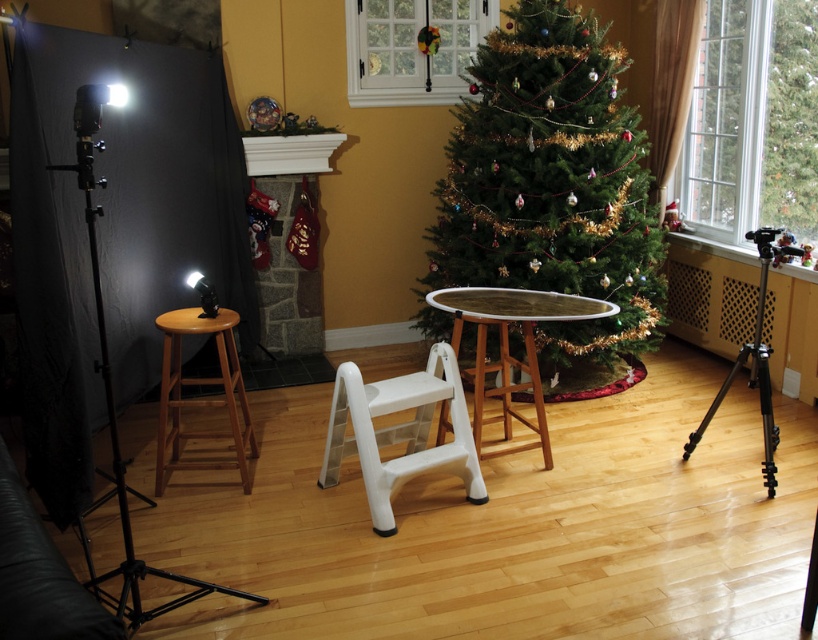
Question: Which object is positioned closest to the wooden table at center?

Choices:
 (A) wooden stool at center-left
 (B) green matte christmas tree at upper right

Answer: (A)

Question: Which is farther from the black metal tripod at lower right?

Choices:
 (A) wooden stool at center-left
 (B) black metal tripod at left
 (C) green textured christmas tree at center

Answer: (B)

Question: Among these points, which one is farthest from the camera?

Choices:
 (A) (794, 234)
 (B) (583, 342)
 (C) (77, 132)
 (D) (703, 417)

Answer: (A)

Question: Does green textured christmas tree at center have a smaller size compared to black metal tripod at lower right?

Choices:
 (A) yes
 (B) no

Answer: (B)

Question: Can you confirm if white plastic step stool at center is wider than wooden stool at center-left?

Choices:
 (A) no
 (B) yes

Answer: (B)

Question: Is wooden stool at center-left bigger than black metal tripod at lower right?

Choices:
 (A) no
 (B) yes

Answer: (B)